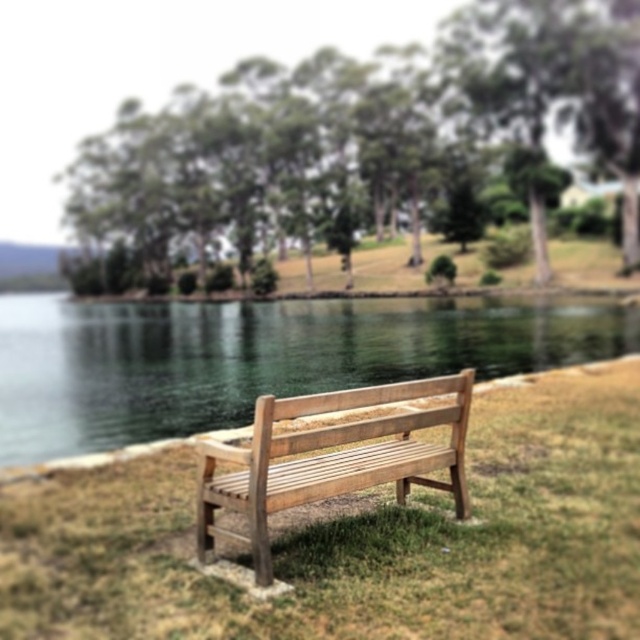
You are planning to place a small picnic basket on the light brown wooden bench at center. Considering the clear water at bench right is wider than the bench, can the bench accommodate the basket without it falling into the water?

The clear water at bench right is wider than the light brown wooden bench at center, so placing the picnic basket near the edge might risk it falling into the water. Ensure the basket is placed safely on the bench away from the water side.

You are a painter setting up your easel to capture the lakeside scene. You want to position yourself so that both the natural grass bench at center and the green leafy trees at upper center are visible in your painting. Based on their positions, which object should you place higher on your canvas?

The green leafy trees at upper center should be placed higher on the canvas since they are located at the upper center of the scene, while the natural grass bench at center is positioned below them.

You are planning to sit on the natural grass bench at center and the light brown wooden bench at center. Which one would you choose if you want to have more space to stretch your legs?

The light brown wooden bench at center is larger in size compared to the natural grass bench at center, so you should choose the light brown wooden bench at center to have more space to stretch your legs.